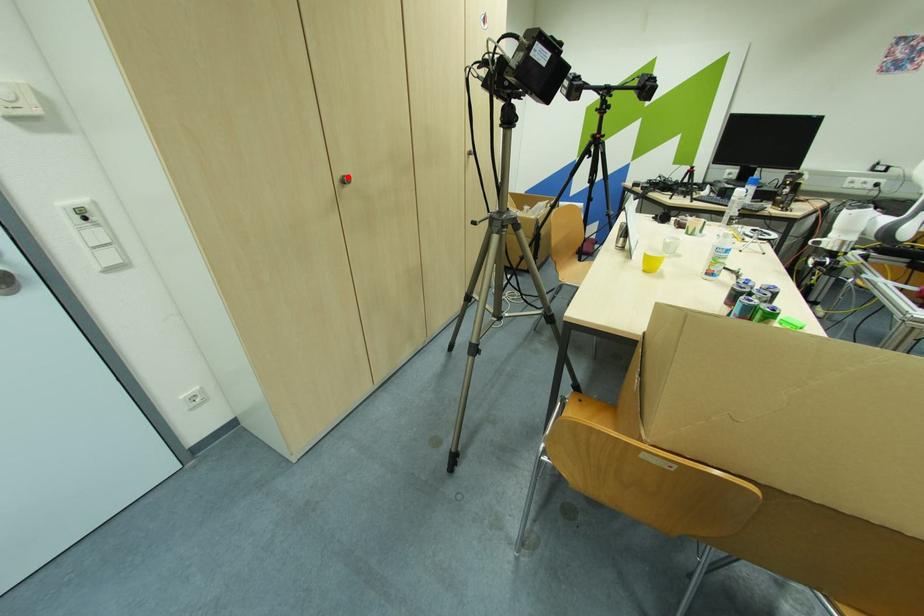
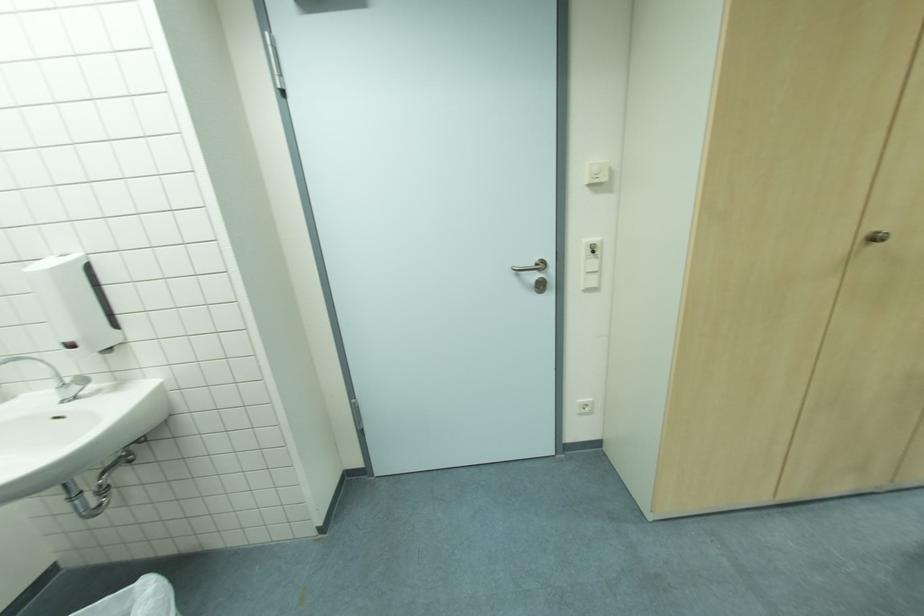
Find the pixel in the second image that matches the highlighted location in the first image.

(877, 233)